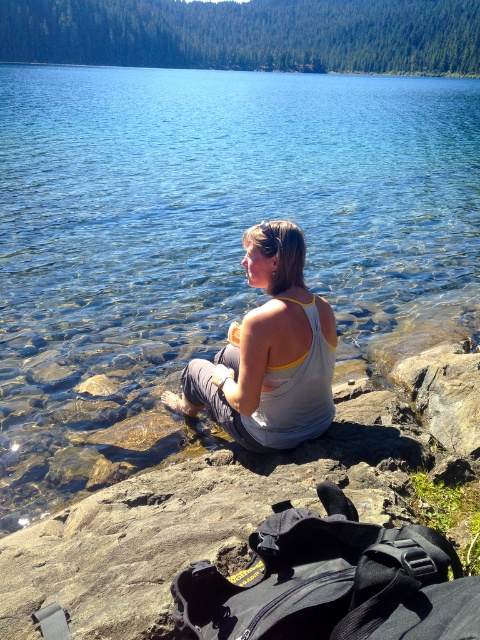
Question: Which of the following is the closest to the observer?

Choices:
 (A) (249, 253)
 (B) (191, 307)

Answer: (A)

Question: Does clear water at center have a larger size compared to white cotton tank top at center?

Choices:
 (A) no
 (B) yes

Answer: (B)

Question: Considering the relative positions of clear water at center and gray rock at right in the image provided, where is clear water at center located with respect to gray rock at right?

Choices:
 (A) left
 (B) right

Answer: (A)

Question: Does white cotton tank top at center come behind gray rock at right?

Choices:
 (A) no
 (B) yes

Answer: (A)

Question: Which of the following is the farthest from the observer?

Choices:
 (A) clear water at center
 (B) gray rock at right
 (C) white cotton tank top at center

Answer: (A)

Question: Which of the following is the farthest from the observer?

Choices:
 (A) (317, 406)
 (B) (8, 364)
 (C) (397, 381)

Answer: (B)